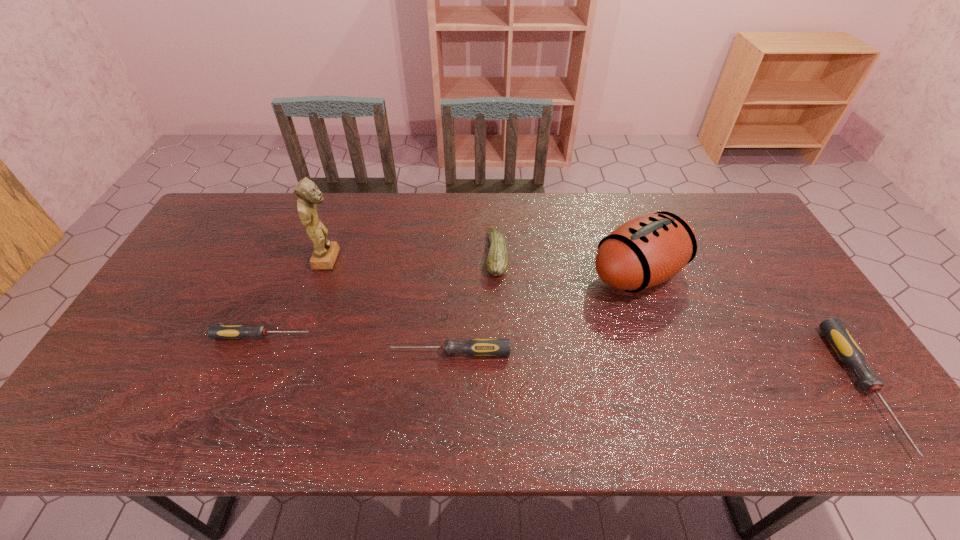
Locate an element on the screen. empty location between the shortest object and the second shortest screwdriver is located at coordinates (356, 344).

You are a GUI agent. You are given a task and a screenshot of the screen. Output one action in this format:
    pyautogui.click(x=<x>, y=<y>)
    Task: Click on the empty space that is in between the shortest object and the rightmost object
    
    Given the screenshot: What is the action you would take?
    pyautogui.click(x=564, y=362)

At what (x,y) coordinates should I click in order to perform the action: click on vacant area that lies between the tallest object and the zucchini. Please return your answer as a coordinate pair (x, y). The height and width of the screenshot is (540, 960). Looking at the image, I should click on (413, 256).

Identify the location of vacant area that lies between the rightmost screwdriver and the leftmost screwdriver. The image size is (960, 540). (564, 362).

The image size is (960, 540). Find the location of `empty space between the rightmost screwdriver and the second screwdriver from right to left`. empty space between the rightmost screwdriver and the second screwdriver from right to left is located at coordinates (657, 370).

In order to click on unoccupied area between the fifth tallest object and the fifth shortest object in this screenshot , I will do `click(544, 313)`.

Locate an element on the screen. This screenshot has width=960, height=540. vacant space in between the tallest object and the zucchini is located at coordinates (413, 256).

Identify which object is the closest to the second screwdriver from right to left. Please provide its 2D coordinates. Your answer should be formatted as a tuple, i.e. [(x, y)], where the tuple contains the x and y coordinates of a point satisfying the conditions above.

[(215, 331)]

Locate which object ranks in proximity to the figurine. Please provide its 2D coordinates. Your answer should be formatted as a tuple, i.e. [(x, y)], where the tuple contains the x and y coordinates of a point satisfying the conditions above.

[(215, 331)]

Identify which screwdriver is the third nearest to the figurine. Please provide its 2D coordinates. Your answer should be formatted as a tuple, i.e. [(x, y)], where the tuple contains the x and y coordinates of a point satisfying the conditions above.

[(845, 346)]